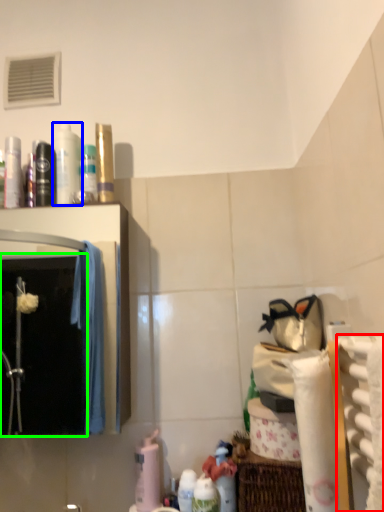
Question: Based on their relative distances, which object is nearer to bath towel (highlighted by a red box)? Choose from mouthwash (highlighted by a blue box) and mirror (highlighted by a green box).

Choices:
 (A) mouthwash
 (B) mirror

Answer: (A)